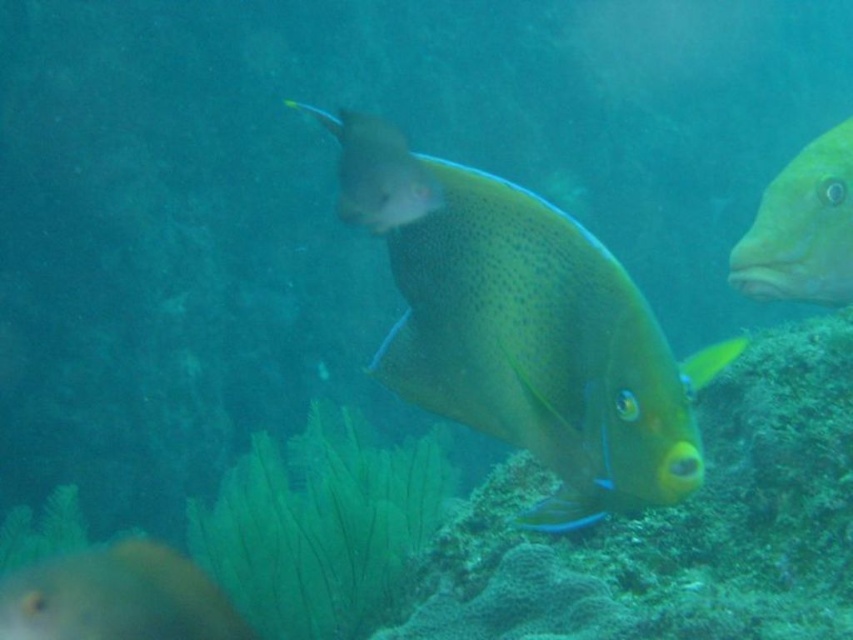
Question: Does translucent yellow fish at center have a smaller size compared to shiny yellow fish at center?

Choices:
 (A) yes
 (B) no

Answer: (B)

Question: Among these objects, which one is farthest from the camera?

Choices:
 (A) shiny yellow fish at center
 (B) yellow matte fish at right

Answer: (A)

Question: Which of these objects is positioned farthest from the translucent yellow fish at center?

Choices:
 (A) yellow matte fish at right
 (B) shiny yellow fish at center

Answer: (B)

Question: Which of the following is the closest to the observer?

Choices:
 (A) translucent yellow fish at center
 (B) shiny yellow fish at center

Answer: (A)

Question: Does translucent yellow fish at center appear on the right side of shiny yellow fish at center?

Choices:
 (A) no
 (B) yes

Answer: (B)

Question: Does shiny yellow fish at center appear under yellow matte fish at right?

Choices:
 (A) yes
 (B) no

Answer: (A)